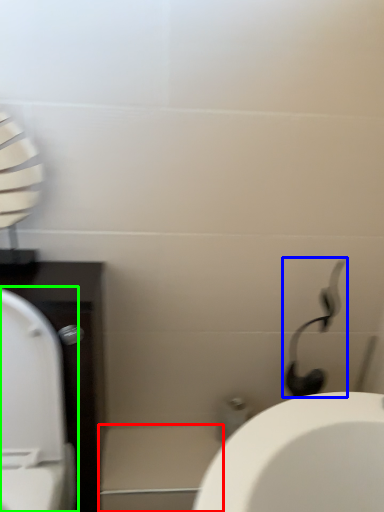
Question: Based on their relative distances, which object is farther from porcelain (highlighted by a red box)? Choose from shower (highlighted by a blue box) and toilet (highlighted by a green box).

Choices:
 (A) shower
 (B) toilet

Answer: (A)